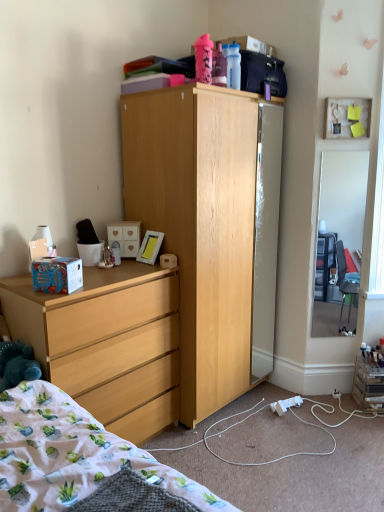
Question: Are matte white picture frame at upper right and velvety blue teddy bear at lower left located far from each other?

Choices:
 (A) yes
 (B) no

Answer: (A)

Question: Does matte white picture frame at upper right have a lesser height compared to velvety blue teddy bear at lower left?

Choices:
 (A) yes
 (B) no

Answer: (B)

Question: Is matte white picture frame at upper right taller than velvety blue teddy bear at lower left?

Choices:
 (A) yes
 (B) no

Answer: (A)

Question: Does matte white picture frame at upper right appear on the left side of velvety blue teddy bear at lower left?

Choices:
 (A) yes
 (B) no

Answer: (B)

Question: Could velvety blue teddy bear at lower left be considered to be inside matte white picture frame at upper right?

Choices:
 (A) yes
 (B) no

Answer: (B)

Question: Is matte white picture frame at upper right oriented away from velvety blue teddy bear at lower left?

Choices:
 (A) no
 (B) yes

Answer: (A)

Question: From a real-world perspective, is matte wood dresser at lower left under velvety blue teddy bear at lower left?

Choices:
 (A) yes
 (B) no

Answer: (A)

Question: Considering the relative sizes of matte wood dresser at lower left and velvety blue teddy bear at lower left in the image provided, is matte wood dresser at lower left taller than velvety blue teddy bear at lower left?

Choices:
 (A) no
 (B) yes

Answer: (B)

Question: Is matte wood dresser at lower left with velvety blue teddy bear at lower left?

Choices:
 (A) no
 (B) yes

Answer: (A)

Question: Is matte wood dresser at lower left not near velvety blue teddy bear at lower left?

Choices:
 (A) no
 (B) yes

Answer: (A)

Question: Does matte wood dresser at lower left lie in front of velvety blue teddy bear at lower left?

Choices:
 (A) no
 (B) yes

Answer: (A)

Question: Could you tell me if matte wood dresser at lower left is turned towards velvety blue teddy bear at lower left?

Choices:
 (A) yes
 (B) no

Answer: (B)

Question: Is fluffy cotton blanket at lower left far away from white matte drawer at center?

Choices:
 (A) yes
 (B) no

Answer: (A)